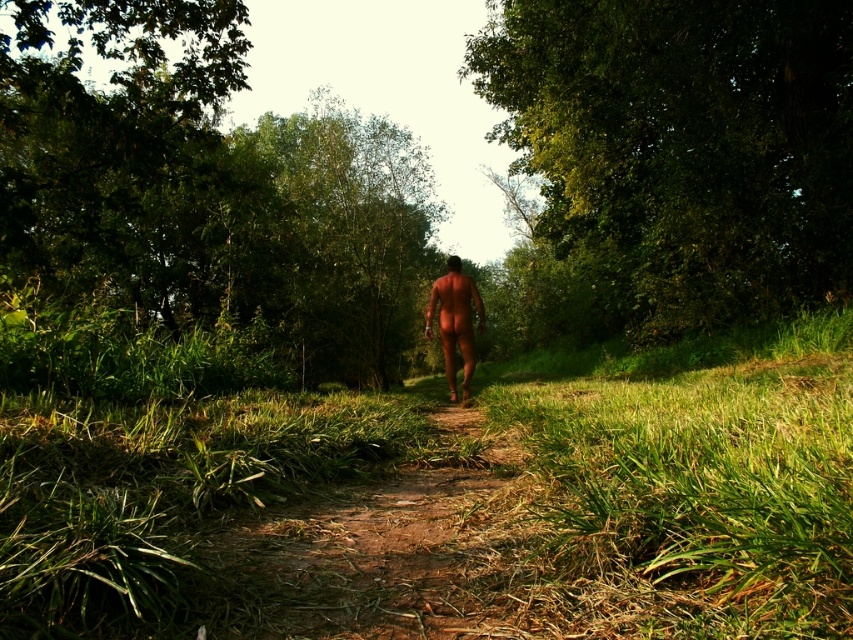
You are a hiker who wants to take a shortcut through the green grass at center and the green leafy tree at upper right. Which object is closer to the ground?

The green grass at center is below green leafy tree at upper right, so the green grass at center is closer to the ground.

You are a photographer planning to take a portrait of the smooth skin man at center. To ensure the subject stands out, you want to position the green leafy tree at upper right in the background. Based on the scene description, can you confirm if the tree will appear smaller or larger than the man in the final photo?

The green leafy tree at upper right is larger in size than smooth skin man at center, so in the photo, the tree will appear larger than the man.

The smooth skin man at center is walking along the narrow dirt path. To ensure he doesn not hit his head, what should he be aware of regarding the green leafy tree at upper right?

The green leafy tree at upper right is taller than the smooth skin man at center, so he doesn not need to worry about hitting his head while walking along the path.